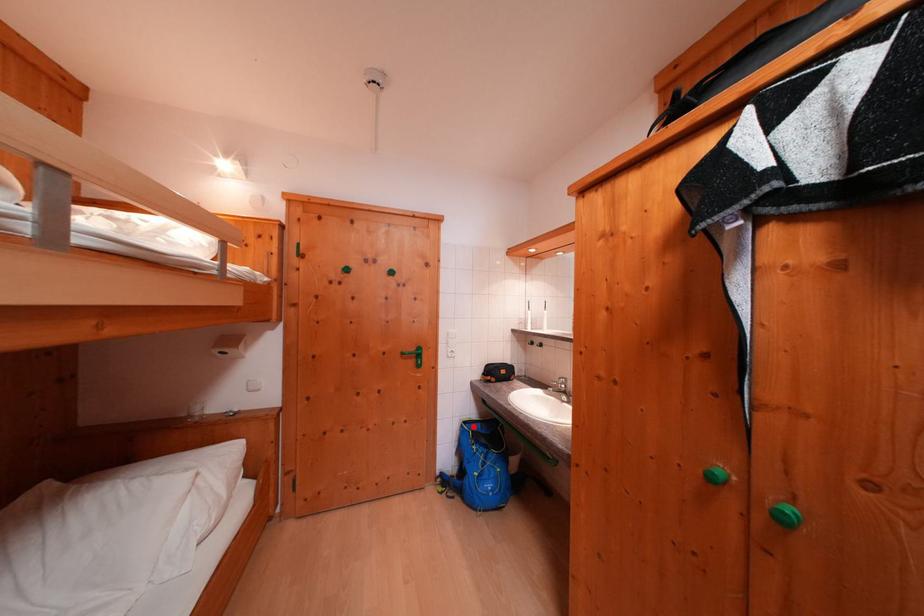
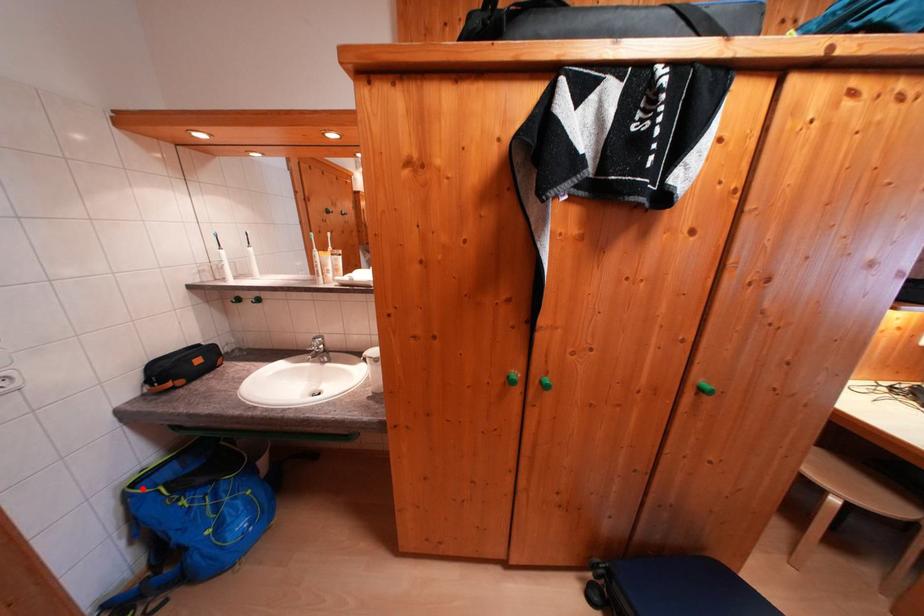
I am providing you with two images of the same scene from different viewpoints. A red point is marked on the first image and another point is marked on the second image. Is the red point in image1 aligned with the point shown in image2?

Yes